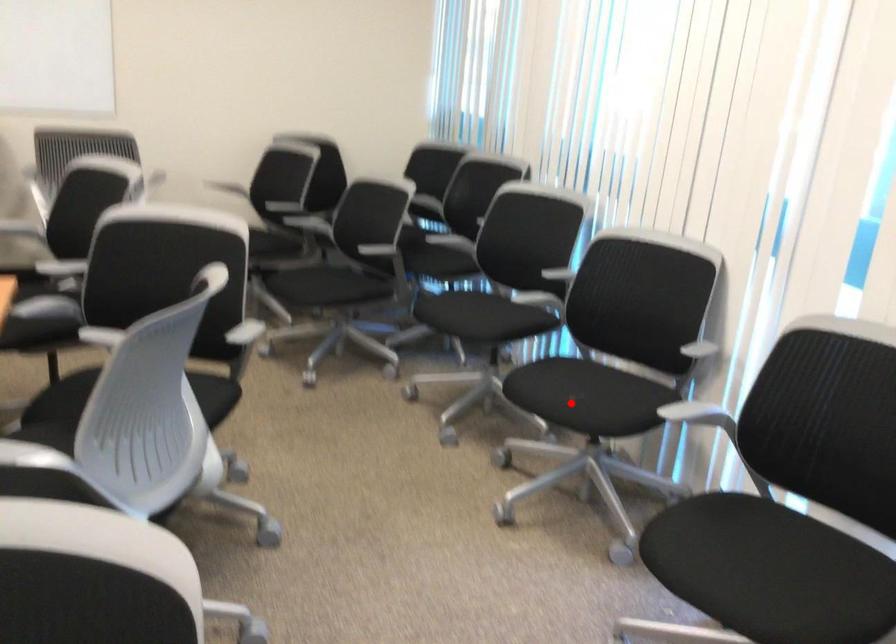
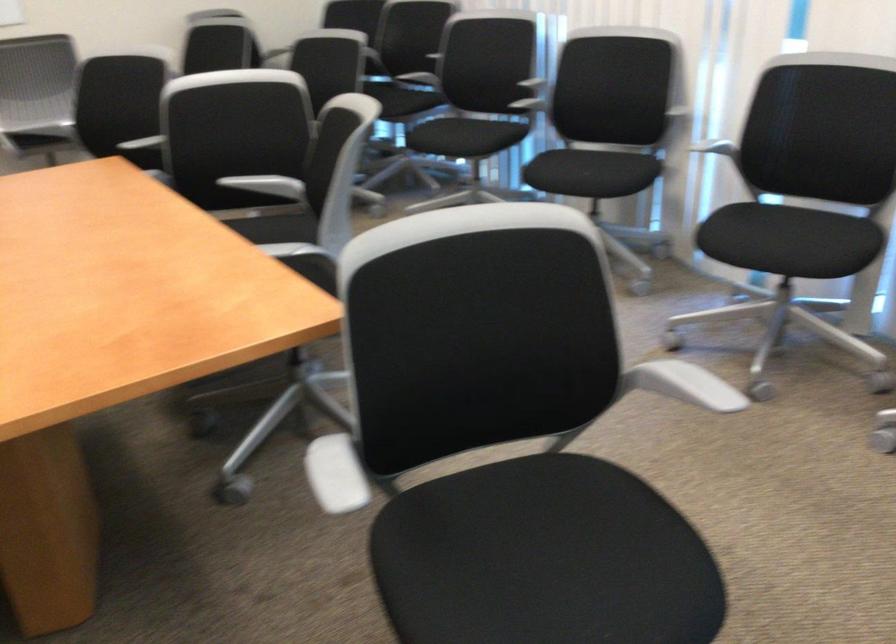
Locate, in the second image, the point that corresponds to the highlighted location in the first image.

(587, 174)